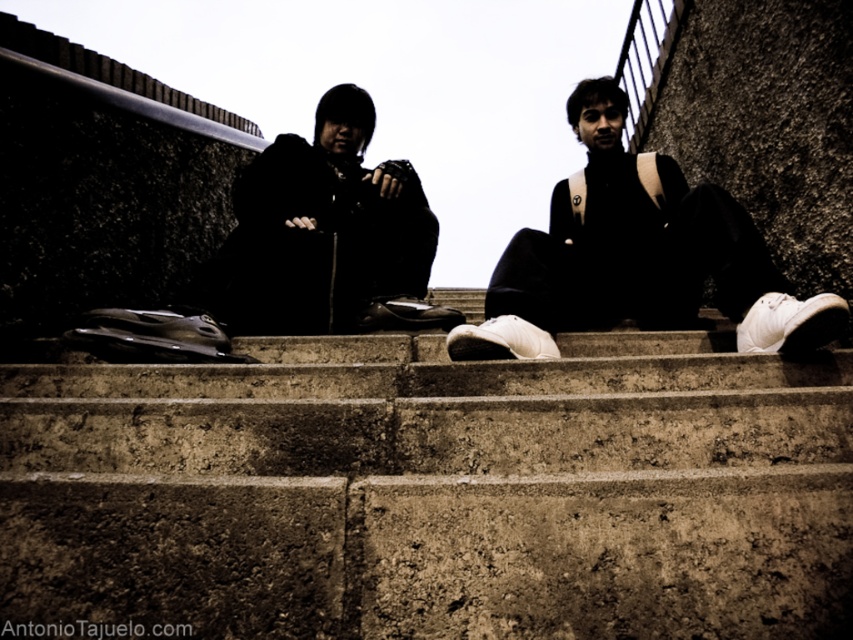
Is concrete stairs at center bigger than white matte sneakers at center?

No, concrete stairs at center is not bigger than white matte sneakers at center.

Which is in front, point (467, 401) or point (601, 324)?

Positioned in front is point (467, 401).

Identify the location of concrete stairs at center. click(431, 492).

Who is more forward, (635, 586) or (328, 272)?

Point (635, 586) is more forward.

Is concrete stairs at center positioned at the back of black matte jacket at center?

No, it is not.

Is point (88, 584) less distant than point (331, 316)?

Yes, it is.

Where is `concrete stairs at center`? This screenshot has width=853, height=640. concrete stairs at center is located at coordinates (431, 492).

Is white matte sneakers at center smaller than black matte jacket at center?

No.

Between white matte sneakers at center and black matte jacket at center, which one appears on the left side from the viewer's perspective?

Positioned to the left is black matte jacket at center.

Locate an element on the screen. white matte sneakers at center is located at coordinates 637,256.